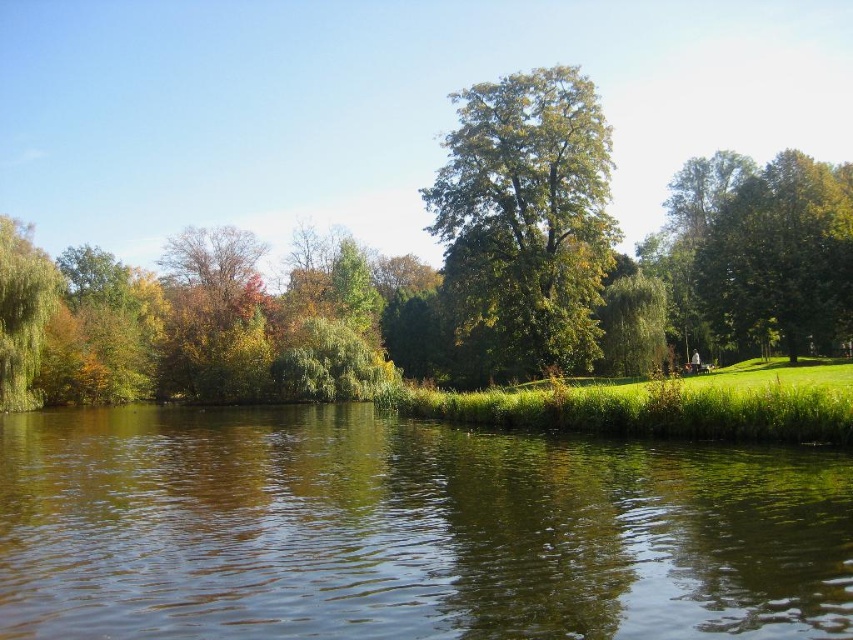
You are standing in the park and see the green leafy tree at center and the green leafy tree at left. Which tree appears taller when viewed from your current position?

The green leafy tree at center is taller than the green leafy tree at left.

You are standing in the park and want to walk towards both the green leafy tree at center and the green leafy tree at upper right. Which tree will you reach first?

You will reach the green leafy tree at center first because it is closer to you than the green leafy tree at upper right, which is further away.

You are a park visitor who wants to take a photo of both the green leafy tree at center and the green leafy tree at upper right. Which tree should you stand closer to in order to capture both in a single frame?

You should stand closer to the green leafy tree at upper right because it is smaller in width compared to the green leafy tree at center, allowing both to fit within the camera frame more easily when positioned closer to the narrower tree.